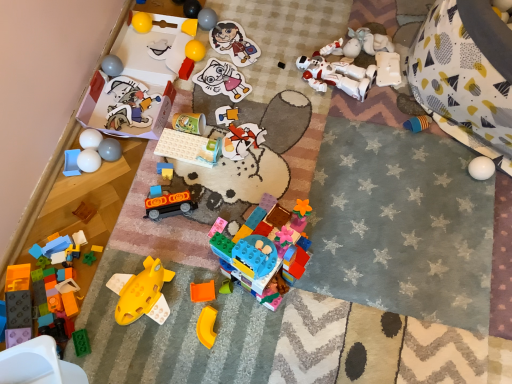
You are a GUI agent. You are given a task and a screenshot of the screen. Output one action in this format:
    pyautogui.click(x=<x>, y=<y>)
    Task: Click on the vacant region in front of yellow rubber ball at upper center, which is the 14th toy from left to right
    
    Given the screenshot: What is the action you would take?
    pyautogui.click(x=201, y=94)